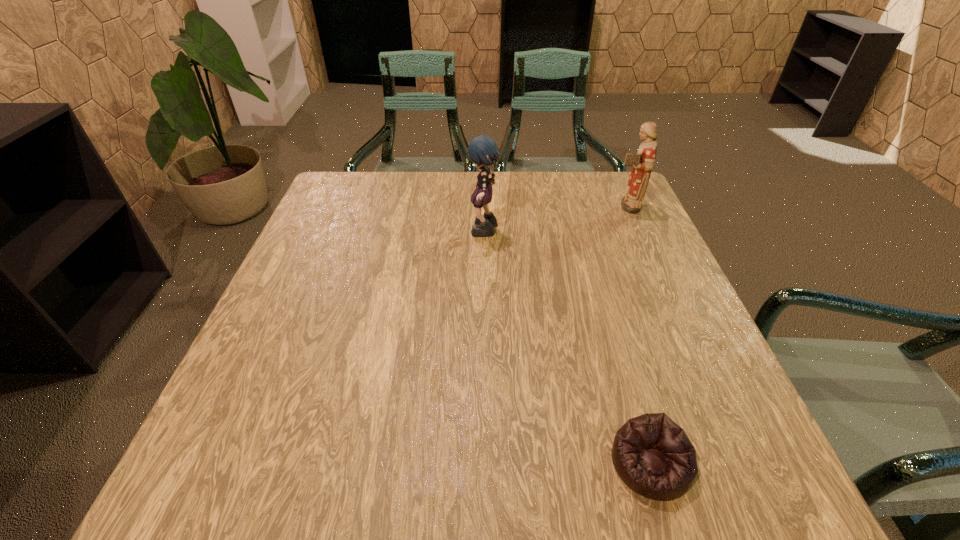
The height and width of the screenshot is (540, 960). I want to click on rag doll, so click(482, 150).

Where is `the leftmost object`? The height and width of the screenshot is (540, 960). the leftmost object is located at coordinates (482, 150).

I want to click on figurine, so click(x=643, y=161).

This screenshot has height=540, width=960. Find the location of `the farthest object`. the farthest object is located at coordinates (643, 161).

Identify the location of beanbag. (653, 456).

I want to click on the nearest object, so click(x=653, y=456).

Find the location of a particular element. This screenshot has height=540, width=960. free space located 0.330m on the front-facing side of the rag doll is located at coordinates (338, 232).

You are a GUI agent. You are given a task and a screenshot of the screen. Output one action in this format:
    pyautogui.click(x=<x>, y=<y>)
    Task: Click on the vacant point located on the front-facing side of the rag doll
    Image resolution: width=960 pixels, height=540 pixels.
    Given the screenshot: What is the action you would take?
    (382, 232)

Find the location of a particular element. vacant space situated on the front-facing side of the rag doll is located at coordinates (338, 232).

You are a GUI agent. You are given a task and a screenshot of the screen. Output one action in this format:
    pyautogui.click(x=<x>, y=<y>)
    Task: Click on the vacant space situated on the front-facing side of the farthest object
    
    Given the screenshot: What is the action you would take?
    pyautogui.click(x=516, y=206)